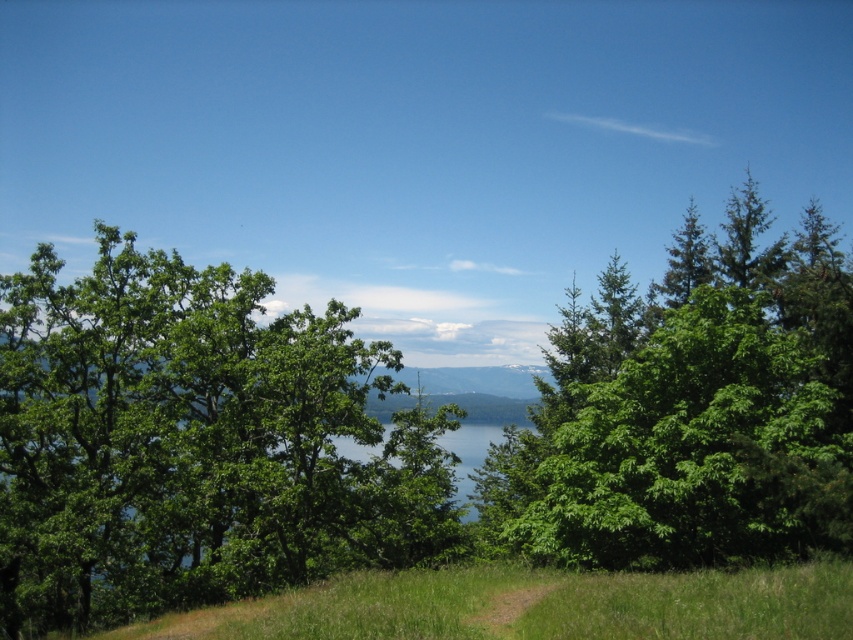
Does green leafy tree at center have a lesser width compared to green leafy tree at right?

Correct, green leafy tree at center's width is less than green leafy tree at right's.

Between point (132, 312) and point (849, 413), which one is positioned in front?

Point (849, 413) is more forward.

Is point (422, 496) closer to viewer compared to point (705, 310)?

No, (422, 496) is behind (705, 310).

Image resolution: width=853 pixels, height=640 pixels. I want to click on green leafy tree at center, so click(x=194, y=444).